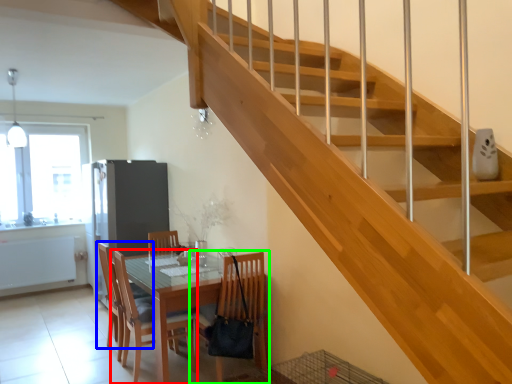
Question: Considering the real-world distances, which object is farthest from chair (highlighted by a red box)? chair (highlighted by a blue box) or chair (highlighted by a green box)?

Choices:
 (A) chair
 (B) chair

Answer: (B)